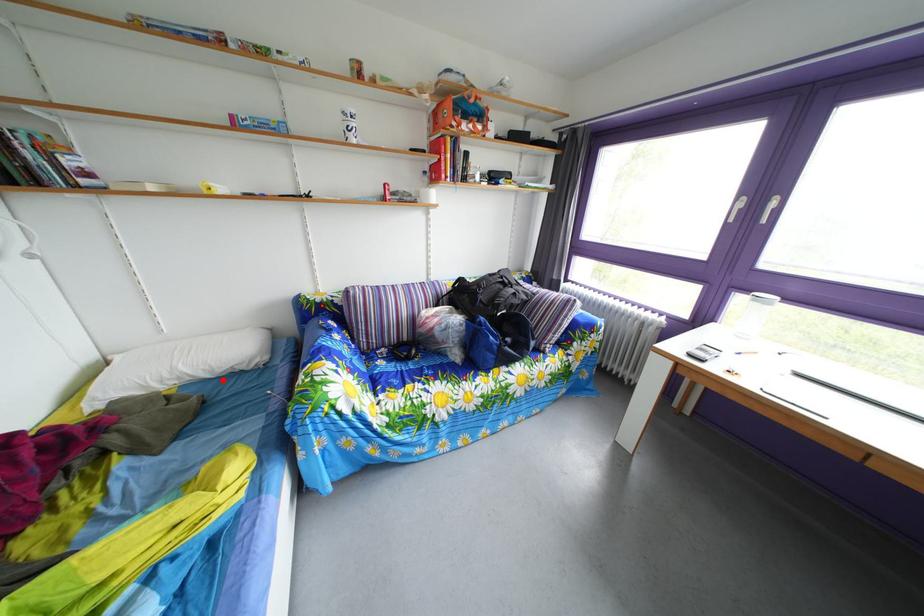
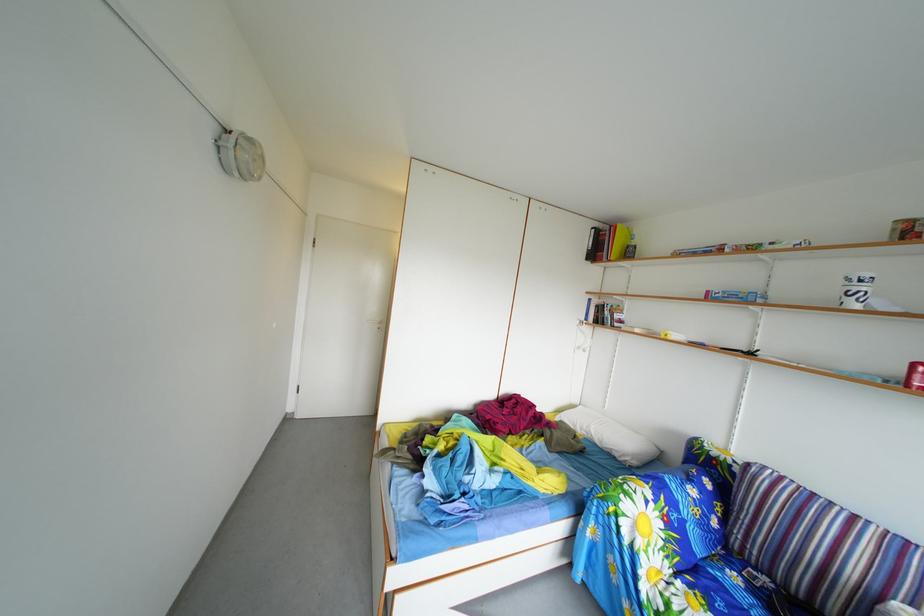
Question: I am providing you with two images of the same scene from different viewpoints. Image1 has a red point marked. In image2, the corresponding 3D location appears at what relative position? Reply with the corresponding letter.

Choices:
 (A) Closer
 (B) Farther

Answer: (B)